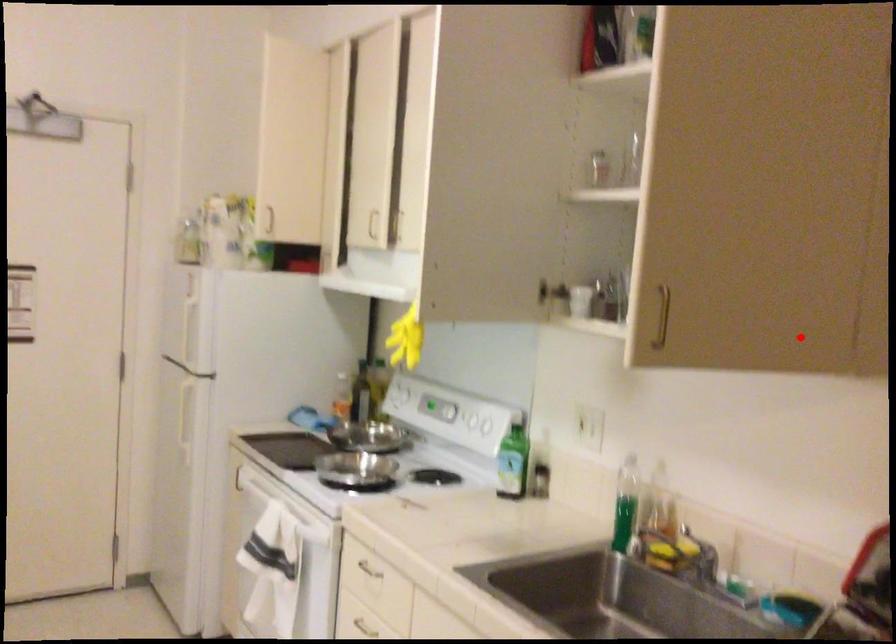
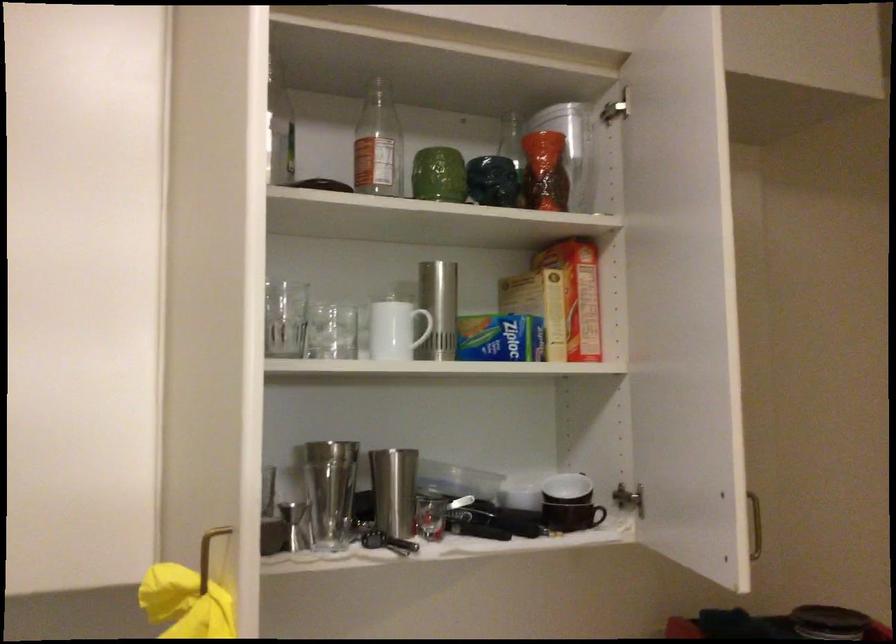
Find the pixel in the second image that matches the highlighted location in the first image.

(570, 504)